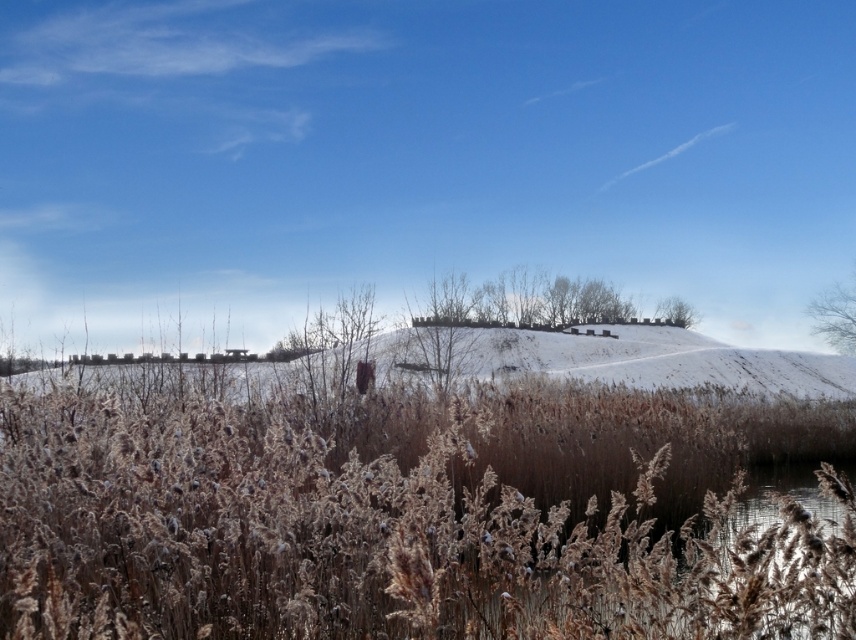
You are standing in the winter landscape and want to walk from the point at coordinates point (849, 294) to the point at coordinates point (664, 317). According to the scene description, will you be moving towards the foreground or the background?

You will be moving towards the background because point (849, 294) is in front of point (664, 317), meaning the latter is located further back in the scene.

Consider the image. You are an ornithologist observing the winter landscape. You notice two trees in the distance. The first is a bare branches at upper right, and the second is a green leafy tree at upper center. Which tree is positioned lower in the image?

The bare branches at upper right is located below the green leafy tree at upper center, so it is positioned lower in the image.

You are standing at the bottom of the slope in the winter landscape scene. You want to walk straight ahead towards the direction of the small body of water on the right side. Will the bare branches at upper right be visible to you as you walk?

The bare branches at upper right are located at coordinates point (x=835, y=316), which is near the top edge of the image. Since you are walking towards the water on the right, the branches will likely remain visible as you move forward because they are positioned high up in the frame.